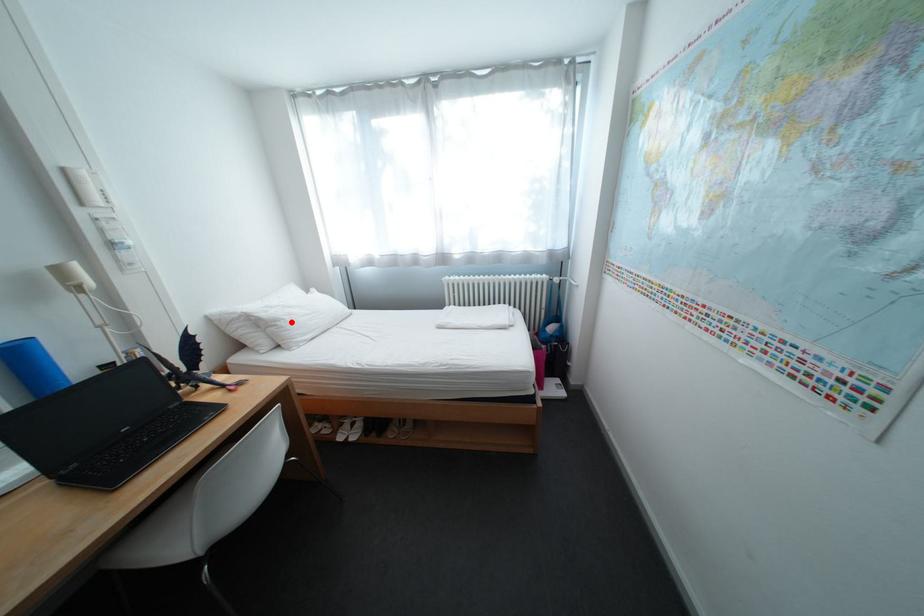
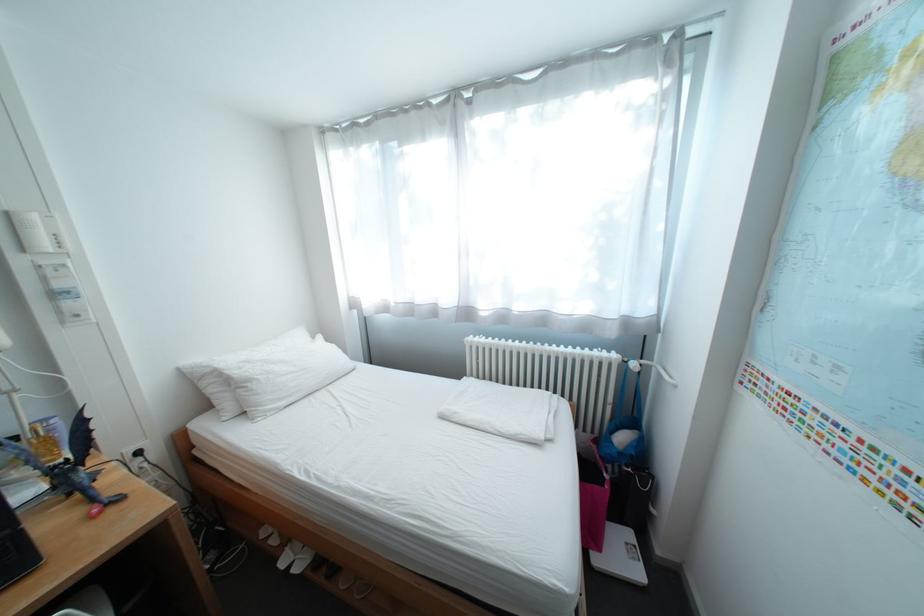
Question: A red point is marked in image1. In image2, is the corresponding 3D point closer to the camera or farther? Reply with the corresponding letter.

Choices:
 (A) The corresponding 3D point is closer.
 (B) The corresponding 3D point is farther.

Answer: (B)